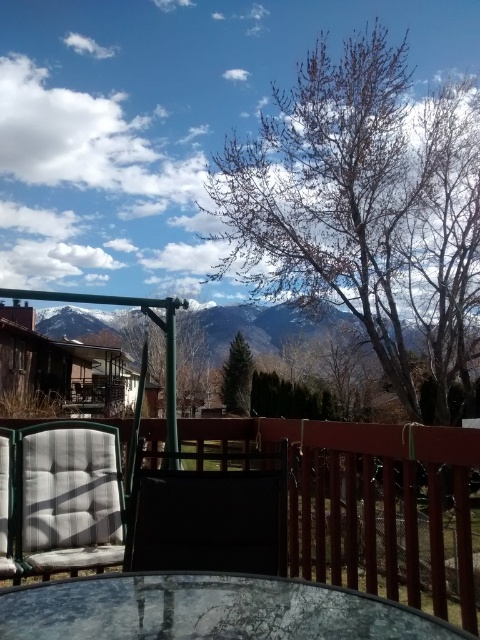
You are planning to place a new bench in the center of the deck where the green metal swing at center and matte black armchair at center are located. Considering their sizes, which object would require more horizontal space between them to avoid overcrowding?

The green metal swing at center requires more horizontal space because its width is larger than the matte black armchair at center.

You are standing on the deck and want to look at two points in the scene. The first point is point (189, 577) and the second is point (100, 486). Which point is closer to you?

Point (189, 577) is closer to the viewer than point (100, 486).